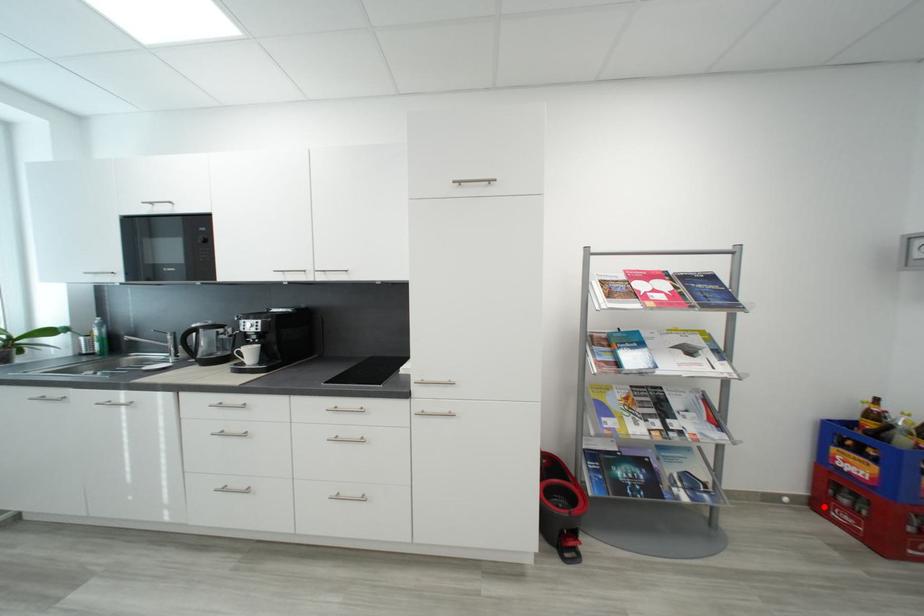
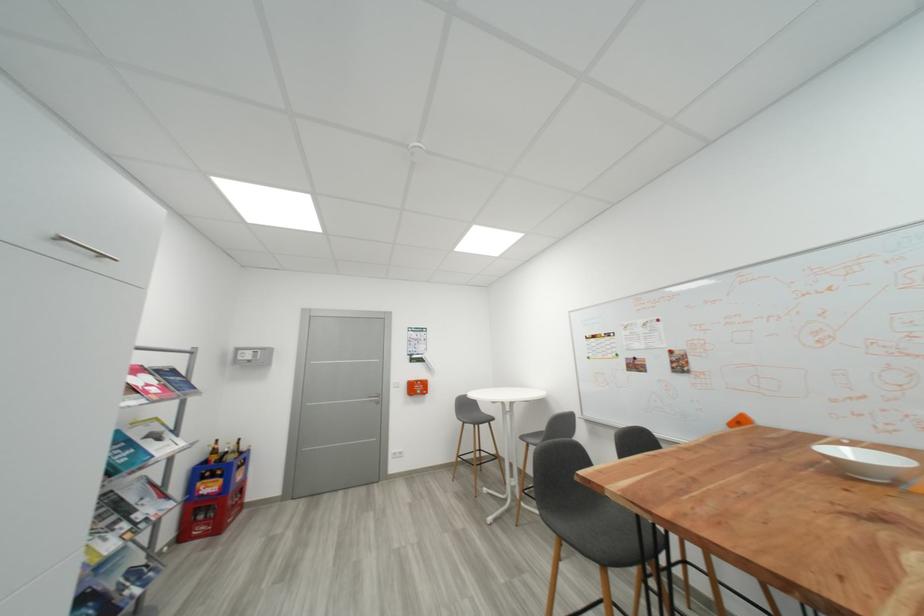
Question: A red point is marked in image1. In image2, is the corresponding 3D point closer to the camera or farther? Reply with the corresponding letter.

Choices:
 (A) The corresponding 3D point is closer.
 (B) The corresponding 3D point is farther.

Answer: (B)